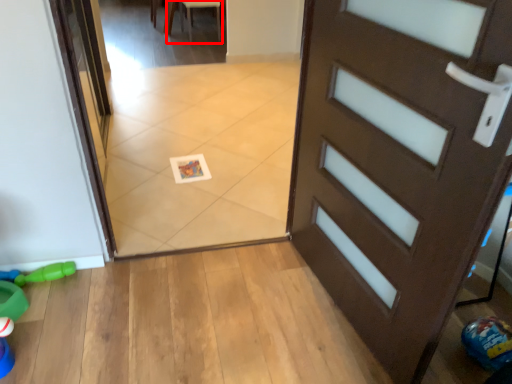
Question: From the image's perspective, what is the correct spatial relationship of chair (annotated by the red box) in relation to toy?

Choices:
 (A) above
 (B) below

Answer: (A)